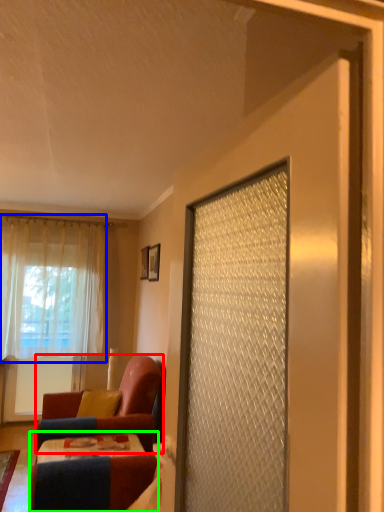
Question: Considering the real-world distances, which object is closest to chair (highlighted by a red box)? curtain (highlighted by a blue box) or table (highlighted by a green box).

Choices:
 (A) curtain
 (B) table

Answer: (B)